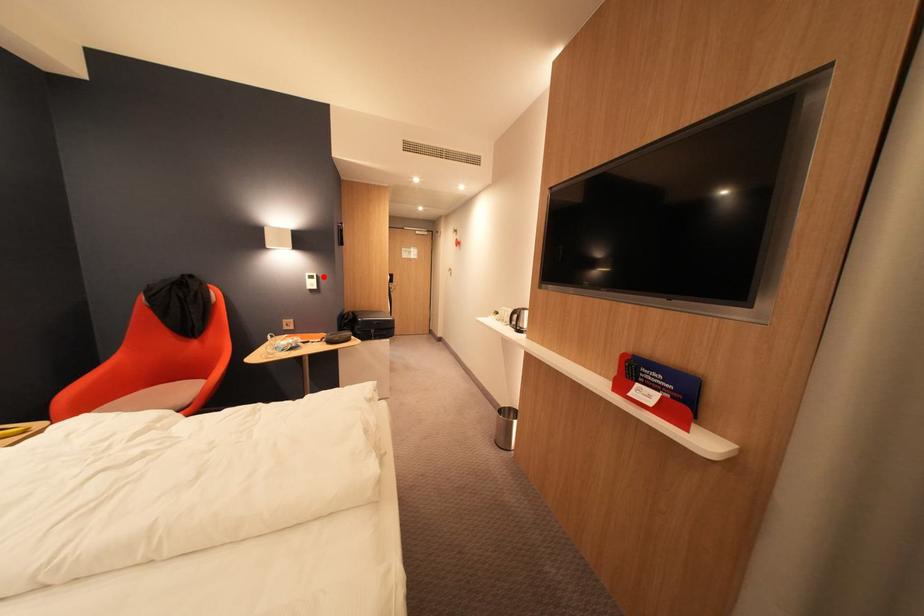
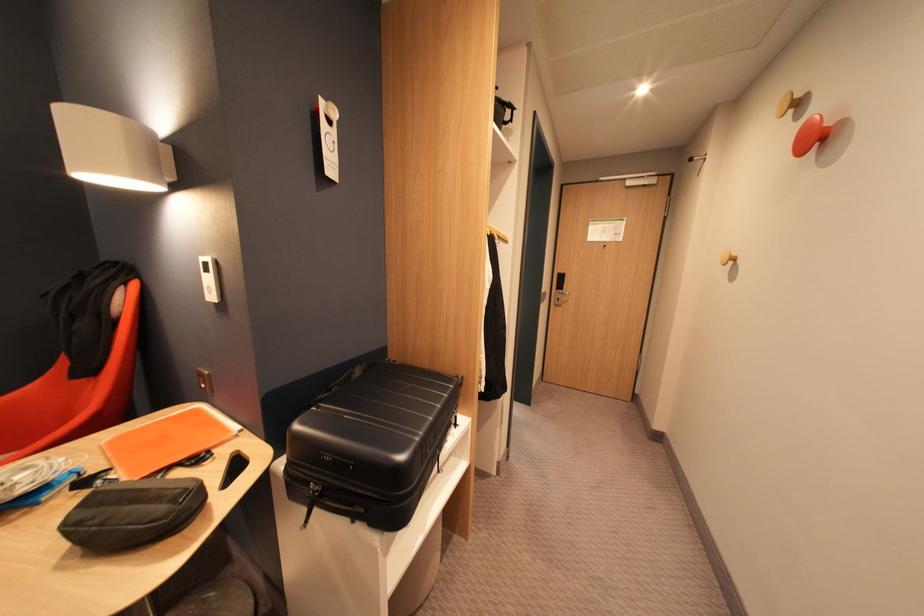
Find the pixel in the second image that matches the highlighted location in the first image.

(216, 265)